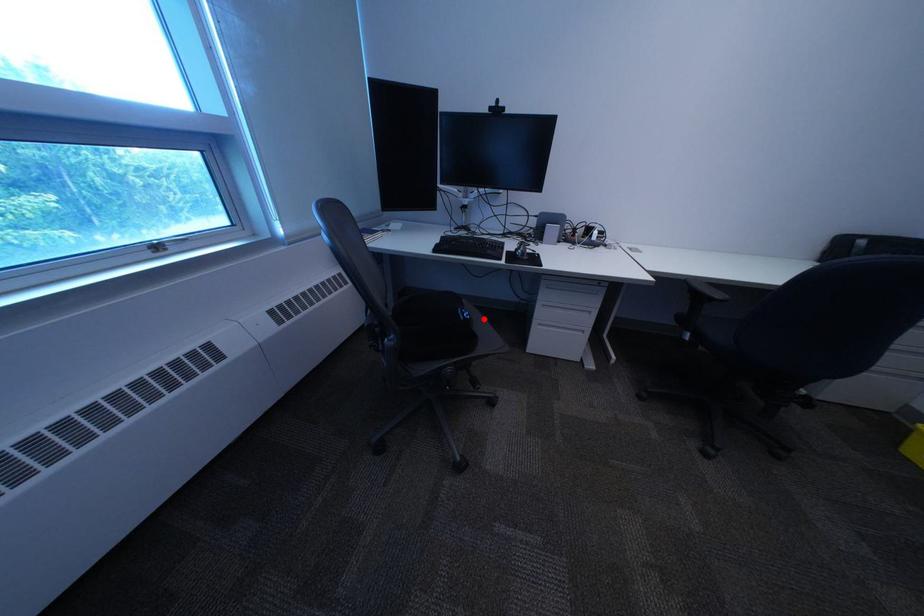
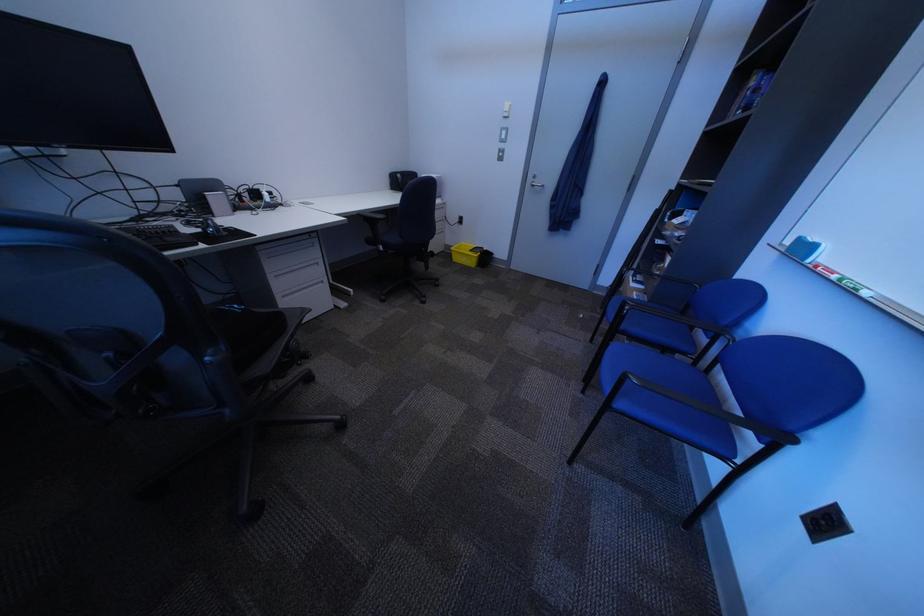
Locate, in the second image, the point that corresponds to the highlighted location in the first image.

(259, 309)